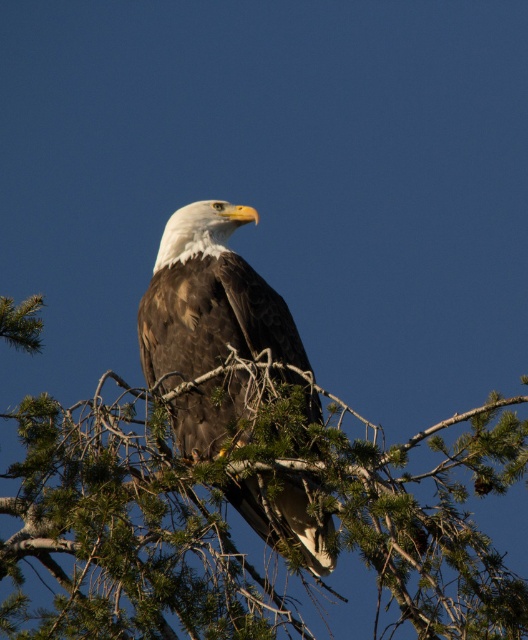
You are a birdwatcher trying to locate the bald eagle in the image. The bald eagle is perched on a branch of a coniferous tree. There is a point marked at coordinates point [265,508]. What is located at that point?

At point [265,508] lies green needle like branches at center.